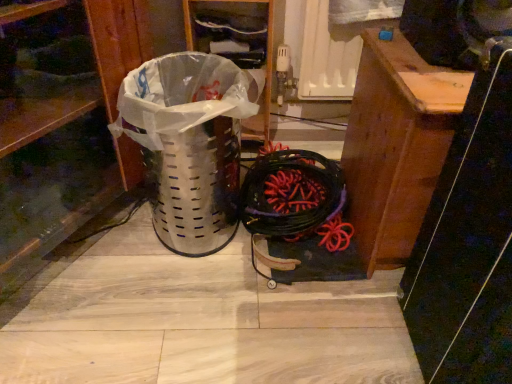
Question: From the image's perspective, is black rubber battle rope at center on brushed metal trash can at left?

Choices:
 (A) no
 (B) yes

Answer: (A)

Question: From the image's perspective, is black rubber battle rope at center below brushed metal trash can at left?

Choices:
 (A) no
 (B) yes

Answer: (B)

Question: From a real-world perspective, is black rubber battle rope at center over brushed metal trash can at left?

Choices:
 (A) no
 (B) yes

Answer: (A)

Question: Can you confirm if black rubber battle rope at center is taller than brushed metal trash can at left?

Choices:
 (A) yes
 (B) no

Answer: (B)

Question: Is there a large distance between black rubber battle rope at center and brushed metal trash can at left?

Choices:
 (A) no
 (B) yes

Answer: (A)

Question: Does black rubber battle rope at center have a lesser width compared to brushed metal trash can at left?

Choices:
 (A) yes
 (B) no

Answer: (A)

Question: Considering the relative sizes of black rubber battle rope at center and metallic perforated trash can at left in the image provided, is black rubber battle rope at center shorter than metallic perforated trash can at left?

Choices:
 (A) no
 (B) yes

Answer: (B)

Question: Can you confirm if black rubber battle rope at center is positioned to the left of metallic perforated trash can at left?

Choices:
 (A) yes
 (B) no

Answer: (B)

Question: Can you confirm if black rubber battle rope at center is positioned to the right of metallic perforated trash can at left?

Choices:
 (A) yes
 (B) no

Answer: (A)

Question: From a real-world perspective, is black rubber battle rope at center on top of metallic perforated trash can at left?

Choices:
 (A) no
 (B) yes

Answer: (A)

Question: Can you confirm if black rubber battle rope at center is thinner than metallic perforated trash can at left?

Choices:
 (A) no
 (B) yes

Answer: (A)

Question: From the image's perspective, is black rubber battle rope at center under metallic perforated trash can at left?

Choices:
 (A) no
 (B) yes

Answer: (B)

Question: Is metallic perforated trash can at left at the left side of wooden plank at center?

Choices:
 (A) yes
 (B) no

Answer: (A)